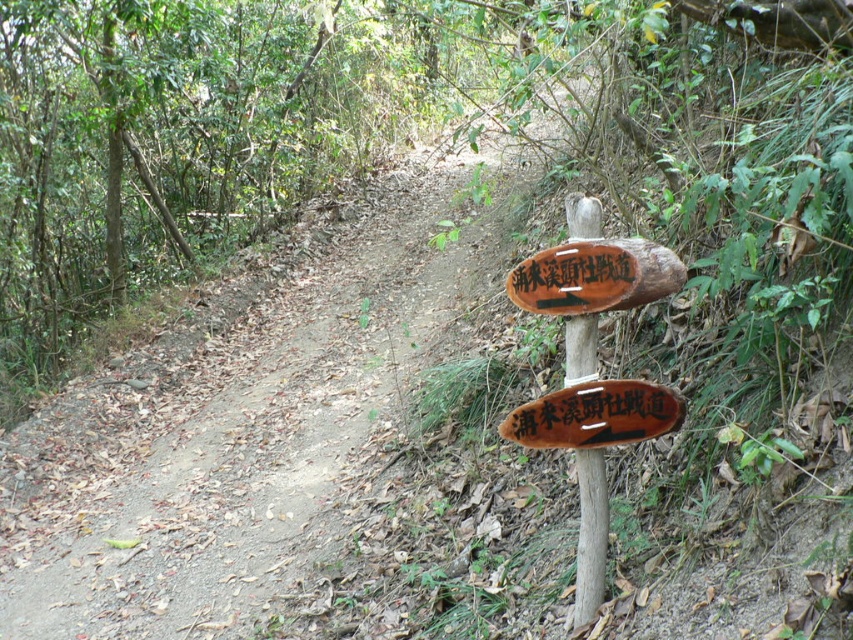
You are a hiker on the forest trail and see the wooden sign at center and the wooden signpost at center. Which one is located to the left?

The wooden sign at center is positioned on the left side of wooden signpost at center, so the wooden sign at center is located to the left.

You are standing at the start of the forest trail and see two points marked on the wooden signpost. Which point is closer to you, point [138,456] or point [573,376]?

Point [138,456] is further to the camera than point [573,376], so the closer point is point [573,376].